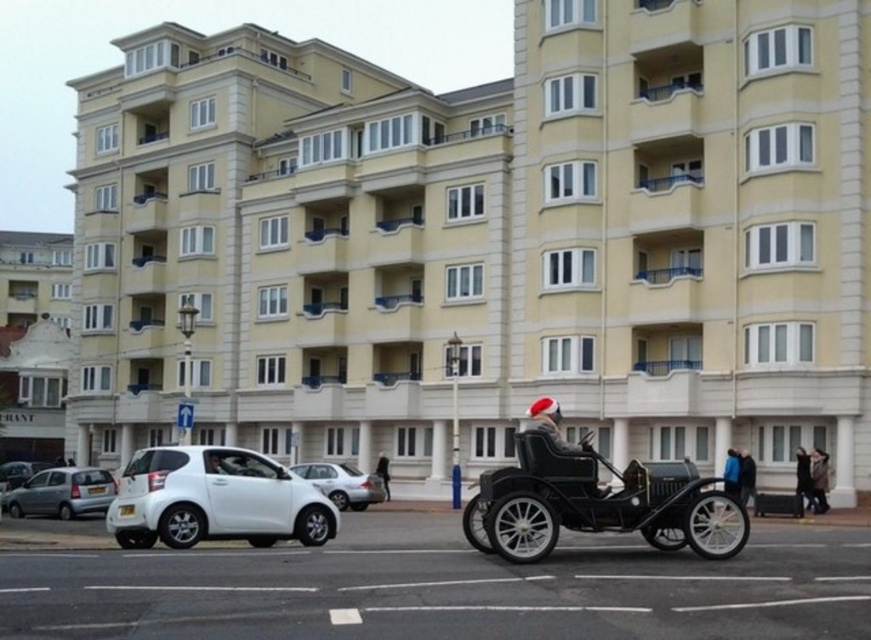
Question: Which of the following is the farthest from the observer?

Choices:
 (A) click(x=5, y=474)
 (B) click(x=342, y=496)
 (C) click(x=827, y=508)

Answer: (A)

Question: From the image, what is the correct spatial relationship of white matte car at lower left in relation to metallic silver car at lower left?

Choices:
 (A) right
 (B) left

Answer: (A)

Question: Does metallic silver car at lower left appear on the right side of black leather jacket at center?

Choices:
 (A) no
 (B) yes

Answer: (A)

Question: Does silver metallic hatchback at lower left have a smaller size compared to dark gray fabric coat at lower right?

Choices:
 (A) yes
 (B) no

Answer: (B)

Question: Estimate the real-world distances between objects in this image. Which object is farther from the black leather jacket at center?

Choices:
 (A) dark blue leather jacket at lower right
 (B) santa hat leather jacket at center
 (C) metallic silver car at lower left

Answer: (C)

Question: Which of the following is the closest to the observer?

Choices:
 (A) (601, 497)
 (B) (245, 54)
 (C) (795, 456)
 (D) (355, 481)

Answer: (A)